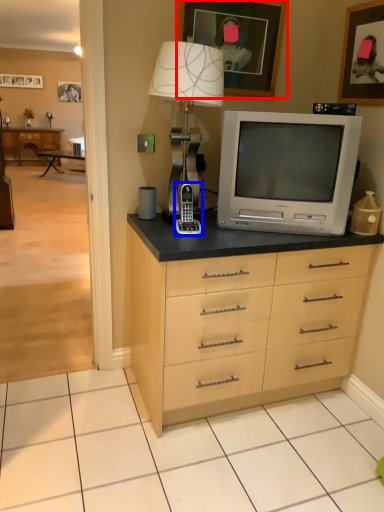
Question: Which object is further to the camera taking this photo, picture frame (highlighted by a red box) or appliance (highlighted by a blue box)?

Choices:
 (A) picture frame
 (B) appliance

Answer: (A)